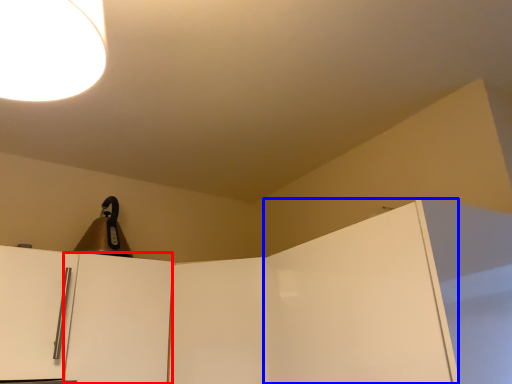
Question: Which object appears farthest to the camera in this image, door (highlighted by a red box) or door (highlighted by a blue box)?

Choices:
 (A) door
 (B) door

Answer: (A)